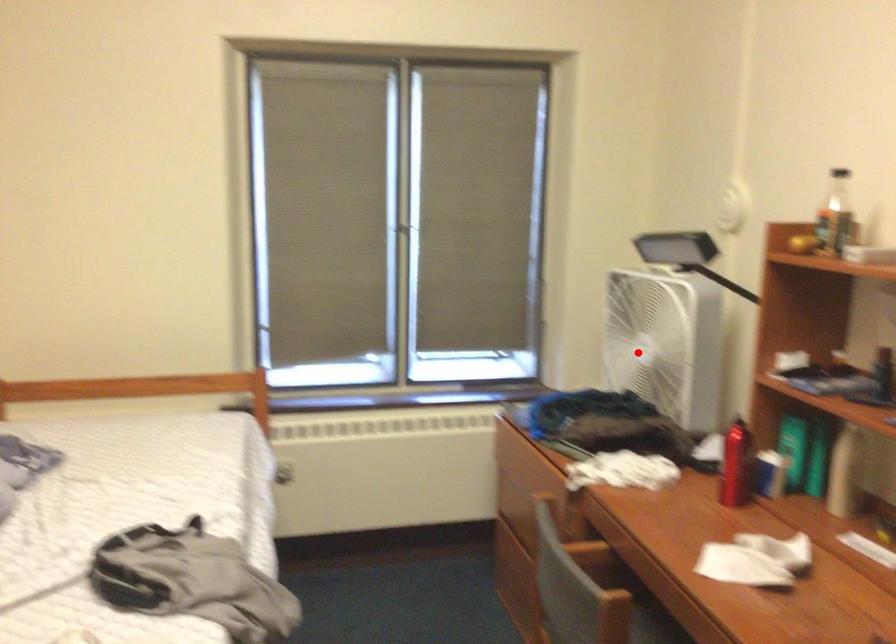
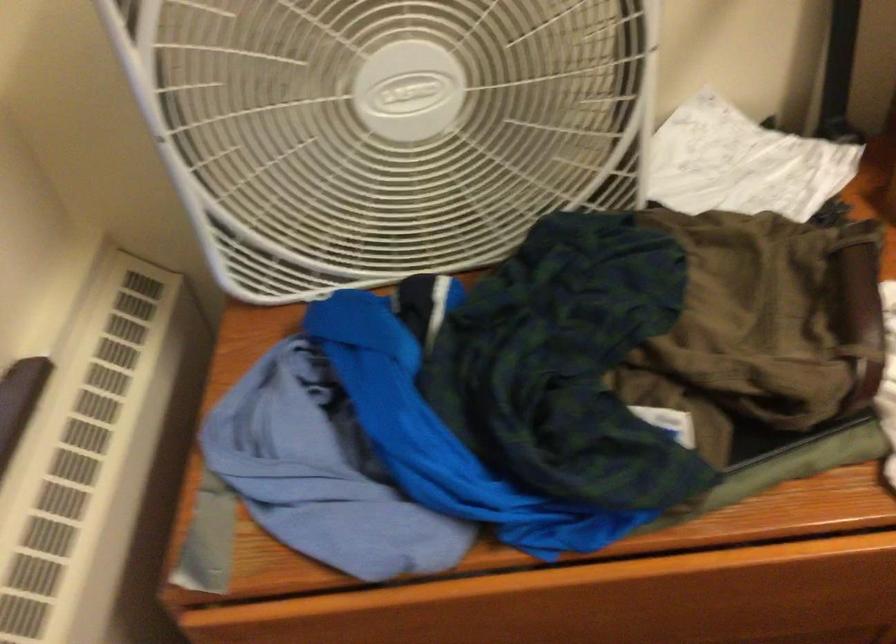
Question: I am providing you with two images of the same scene from different viewpoints. Given a red point in image1, look at the same physical point in image2. Is it:

Choices:
 (A) Closer to the viewpoint
 (B) Farther from the viewpoint

Answer: (A)